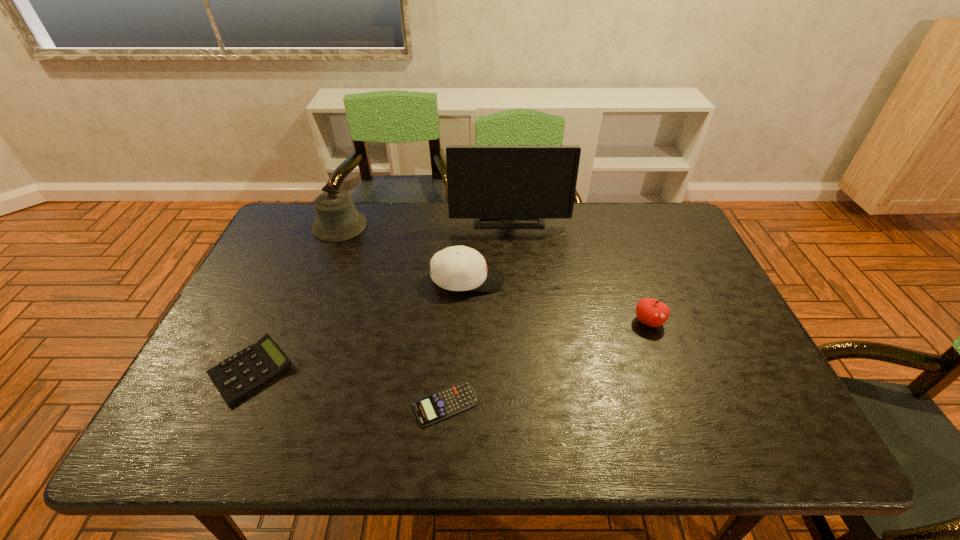
At what (x,y) coordinates should I click in order to perform the action: click on vacant area that lies between the second tallest object and the third farthest object. Please return your answer as a coordinate pair (x, y). Looking at the image, I should click on (404, 253).

Locate an element on the screen. The image size is (960, 540). free point between the bell and the tallest object is located at coordinates (424, 221).

In order to click on unoccupied area between the baseball cap and the computer monitor in this screenshot , I will do `click(489, 248)`.

Find the location of a particular element. Image resolution: width=960 pixels, height=540 pixels. free space between the taller calculator and the shortest object is located at coordinates pos(348,387).

The height and width of the screenshot is (540, 960). What are the coordinates of `vacant area between the third nearest object and the right calculator` in the screenshot? It's located at (547, 363).

At what (x,y) coordinates should I click in order to perform the action: click on unoccupied position between the bell and the shorter calculator. Please return your answer as a coordinate pair (x, y). The height and width of the screenshot is (540, 960). Looking at the image, I should click on (393, 315).

The width and height of the screenshot is (960, 540). I want to click on free space between the baseball cap and the taller calculator, so click(359, 326).

Locate an element on the screen. The height and width of the screenshot is (540, 960). free space that is in between the fourth shortest object and the second tallest object is located at coordinates (404, 253).

Point out which object is positioned as the third nearest to the second tallest object. Please provide its 2D coordinates. Your answer should be formatted as a tuple, i.e. [(x, y)], where the tuple contains the x and y coordinates of a point satisfying the conditions above.

[(241, 374)]

This screenshot has height=540, width=960. In order to click on the fourth closest object relative to the third tallest object in this screenshot , I will do `click(653, 313)`.